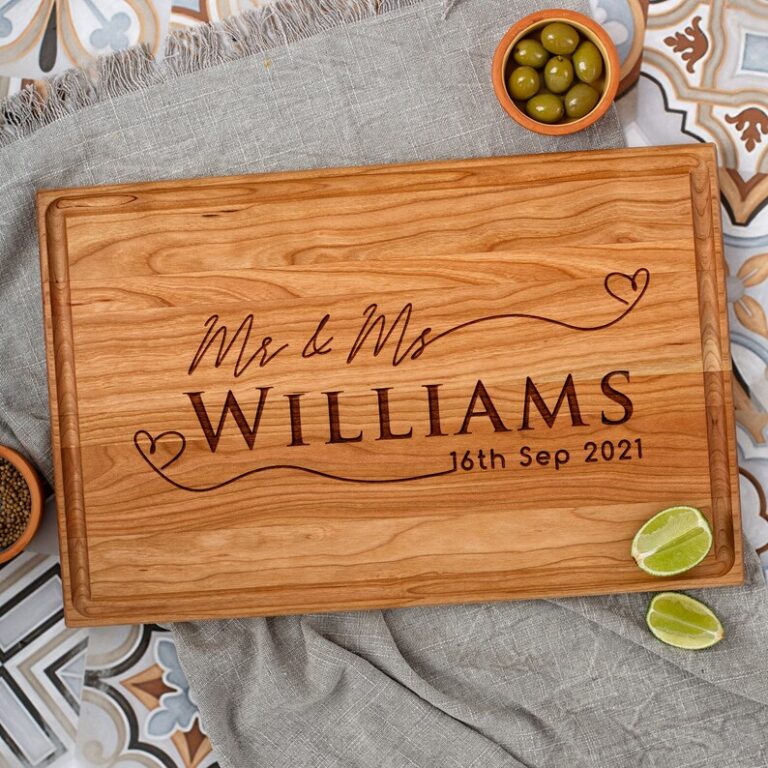
This screenshot has height=768, width=768. Identify the location of fold mark in fabric. (604, 630).